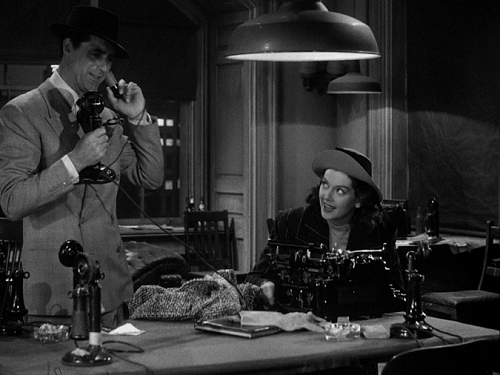
You are a GUI agent. You are given a task and a screenshot of the screen. Output one action in this format:
    pyautogui.click(x=<x>, y=<y>)
    Task: Click on the table in front of people
    Image resolution: width=500 pixels, height=375 pixels.
    Given the screenshot: What is the action you would take?
    pyautogui.click(x=199, y=344)